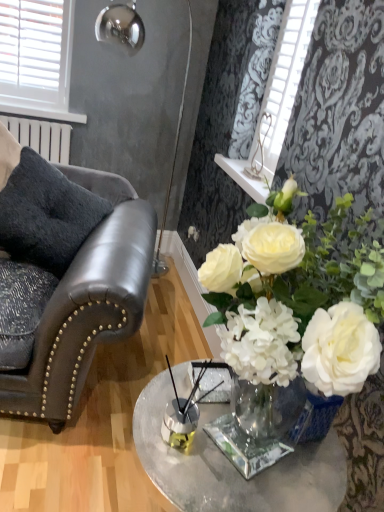
This screenshot has height=512, width=384. What are the coordinates of `vacant space situated above clear glass table at center (from a real-world perspective)` in the screenshot? It's located at (223, 436).